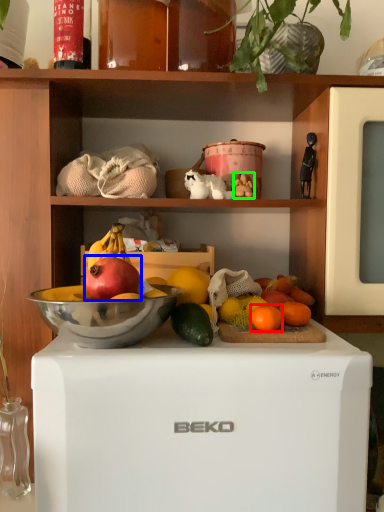
Question: Which object is positioned closest to grapefruit (highlighted by a red box)? Select from grapefruit (highlighted by a blue box) and toy (highlighted by a green box).

Choices:
 (A) grapefruit
 (B) toy

Answer: (A)